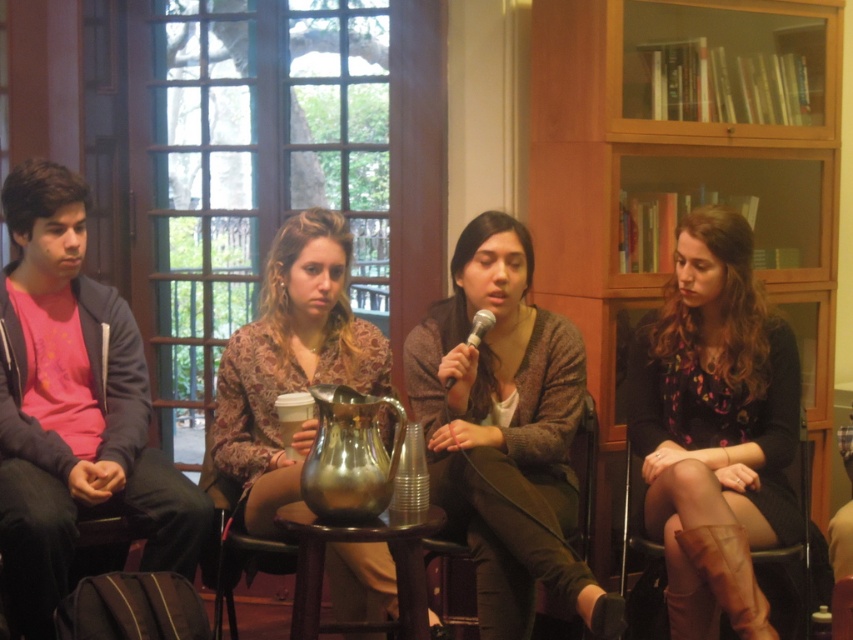
You are organizing a small event and need to seat two people. You have a wooden chair at center and a leather at right. Which chair can accommodate a larger person?

The leather at right is larger than the wooden chair at center, so it can accommodate a larger person.